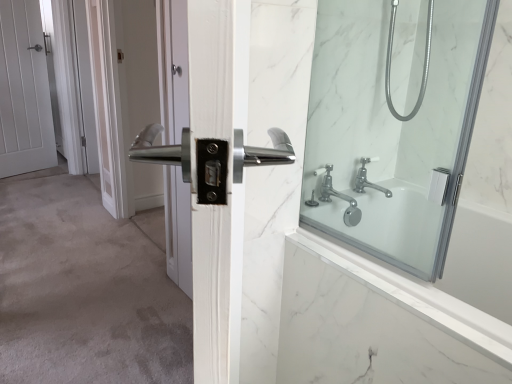
Question: Is polished silver handle at center, arranged as the 1th screen door when viewed from the front, thinner than clear glass shower door at right?

Choices:
 (A) no
 (B) yes

Answer: (A)

Question: Is polished silver handle at center, the 1th screen door positioned from the right, aimed at clear glass shower door at right?

Choices:
 (A) yes
 (B) no

Answer: (B)

Question: Would you say clear glass shower door at right is part of polished silver handle at center, the 1th screen door positioned from the right,'s contents?

Choices:
 (A) yes
 (B) no

Answer: (B)

Question: Is polished silver handle at center, marked as the 2th screen door in a left-to-right arrangement, shorter than clear glass shower door at right?

Choices:
 (A) no
 (B) yes

Answer: (A)

Question: From the image's perspective, would you say polished silver handle at center, marked as the 2th screen door in a left-to-right arrangement, is positioned over clear glass shower door at right?

Choices:
 (A) yes
 (B) no

Answer: (A)

Question: Is polished silver handle at center, marked as the 2th screen door in a left-to-right arrangement, placed right next to clear glass shower door at right?

Choices:
 (A) yes
 (B) no

Answer: (B)

Question: Is polished silver handle at center, the second screen door in the back-to-front sequence, positioned far away from white glossy door at upper left, the first screen door positioned from the back?

Choices:
 (A) yes
 (B) no

Answer: (B)

Question: From the image's perspective, is polished silver handle at center, the second screen door in the back-to-front sequence, located above white glossy door at upper left, the first screen door positioned from the back?

Choices:
 (A) yes
 (B) no

Answer: (B)

Question: Can you confirm if polished silver handle at center, the second screen door in the back-to-front sequence, is shorter than white glossy door at upper left, the second screen door when ordered from right to left?

Choices:
 (A) no
 (B) yes

Answer: (B)

Question: Is the position of polished silver handle at center, the 1th screen door positioned from the right, more distant than that of white glossy door at upper left, arranged as the 2th screen door when viewed from the front?

Choices:
 (A) no
 (B) yes

Answer: (A)

Question: Is polished silver handle at center, marked as the 2th screen door in a left-to-right arrangement, wider than white glossy door at upper left, which is counted as the first screen door, starting from the left?

Choices:
 (A) no
 (B) yes

Answer: (B)

Question: From the image's perspective, is polished silver handle at center, the 1th screen door positioned from the right, below white glossy door at upper left, the second screen door when ordered from right to left?

Choices:
 (A) yes
 (B) no

Answer: (A)

Question: Can you confirm if polished silver handle at center, the second screen door in the back-to-front sequence, is positioned to the left of chrome metallic faucet at upper right?

Choices:
 (A) yes
 (B) no

Answer: (A)